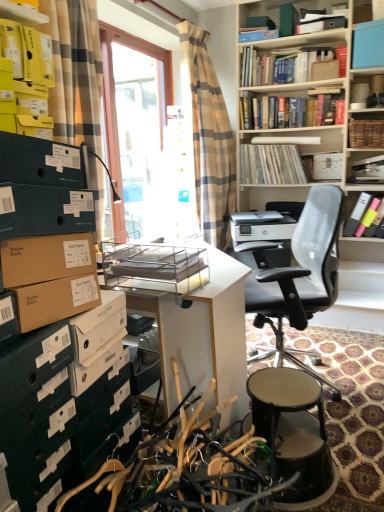
Question: Can you confirm if woven brown basket at upper right, the 3th shelf in the front-to-back sequence, is smaller than yellow cardboard boxes at upper left, which is counted as the 2th shelf, starting from the top?

Choices:
 (A) yes
 (B) no

Answer: (A)

Question: Is woven brown basket at upper right, the 1th shelf when ordered from top to bottom, bigger than yellow cardboard boxes at upper left, the second shelf viewed from the back?

Choices:
 (A) yes
 (B) no

Answer: (B)

Question: Does woven brown basket at upper right, the 1th shelf when ordered from top to bottom, appear on the left side of yellow cardboard boxes at upper left, which is counted as the 2th shelf, starting from the top?

Choices:
 (A) yes
 (B) no

Answer: (B)

Question: Is woven brown basket at upper right, which is the third shelf from left to right, with yellow cardboard boxes at upper left, positioned as the 3th shelf in right-to-left order?

Choices:
 (A) no
 (B) yes

Answer: (A)

Question: From the image's perspective, is woven brown basket at upper right, the third shelf ordered from the bottom, below yellow cardboard boxes at upper left, acting as the 1th shelf starting from the left?

Choices:
 (A) yes
 (B) no

Answer: (B)

Question: Considering their positions, is beige plaid curtain at center, arranged as the 2th curtain when viewed from the front, located in front of or behind transparent glass door at center?

Choices:
 (A) behind
 (B) front

Answer: (B)

Question: In the image, is beige plaid curtain at center, the 2th curtain from the left, on the left side or the right side of transparent glass door at center?

Choices:
 (A) right
 (B) left

Answer: (A)

Question: Based on their sizes in the image, would you say beige plaid curtain at center, the first curtain in the right-to-left sequence, is bigger or smaller than transparent glass door at center?

Choices:
 (A) small
 (B) big

Answer: (B)

Question: From a real-world perspective, relative to transparent glass door at center, is beige plaid curtain at center, the 1th curtain from the back, vertically above or below?

Choices:
 (A) below
 (B) above

Answer: (A)

Question: Is point (302, 382) positioned closer to the camera than point (157, 245)?

Choices:
 (A) closer
 (B) farther

Answer: (A)

Question: From a real-world perspective, is wooden stool at lower right above or below white glossy desk at center?

Choices:
 (A) below
 (B) above

Answer: (A)

Question: From the image's perspective, is wooden stool at lower right located above or below white glossy desk at center?

Choices:
 (A) below
 (B) above

Answer: (A)

Question: Would you say wooden stool at lower right is inside or outside white glossy desk at center?

Choices:
 (A) inside
 (B) outside

Answer: (B)

Question: Considering the positions of hardcover book at upper center, acting as the third book starting from the bottom, and woven brown basket at upper right, the third shelf ordered from the bottom, in the image, is hardcover book at upper center, acting as the third book starting from the bottom, taller or shorter than woven brown basket at upper right, the third shelf ordered from the bottom,?

Choices:
 (A) tall
 (B) short

Answer: (A)

Question: Looking at the image, does hardcover book at upper center, which is the 2th book from top to bottom, seem bigger or smaller compared to woven brown basket at upper right, the third shelf ordered from the bottom?

Choices:
 (A) big
 (B) small

Answer: (A)